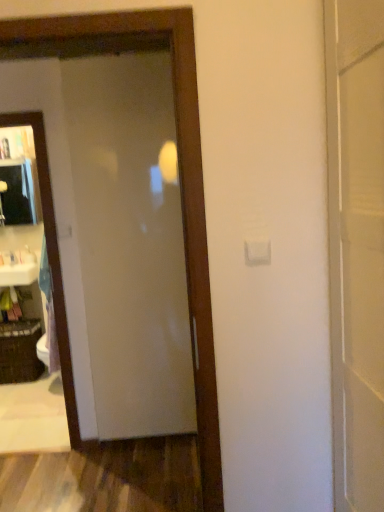
Question: From the image's perspective, is matte glass door at center above or below white glossy sink at left?

Choices:
 (A) above
 (B) below

Answer: (A)

Question: Looking at the image, does matte glass door at center seem bigger or smaller compared to white glossy sink at left?

Choices:
 (A) small
 (B) big

Answer: (B)

Question: Which of these objects is positioned closest to the clear glass mirror at left?

Choices:
 (A) black woven basket at lower left
 (B) matte black medicine cabinet at left
 (C) matte glass door at center
 (D) white plastic bag at left
 (E) white glossy sink at left

Answer: (C)

Question: Which is nearer to the white plastic bag at left?

Choices:
 (A) matte glass door at center
 (B) black woven basket at lower left
 (C) matte black medicine cabinet at left
 (D) white glossy sink at left
 (E) clear glass mirror at left

Answer: (D)